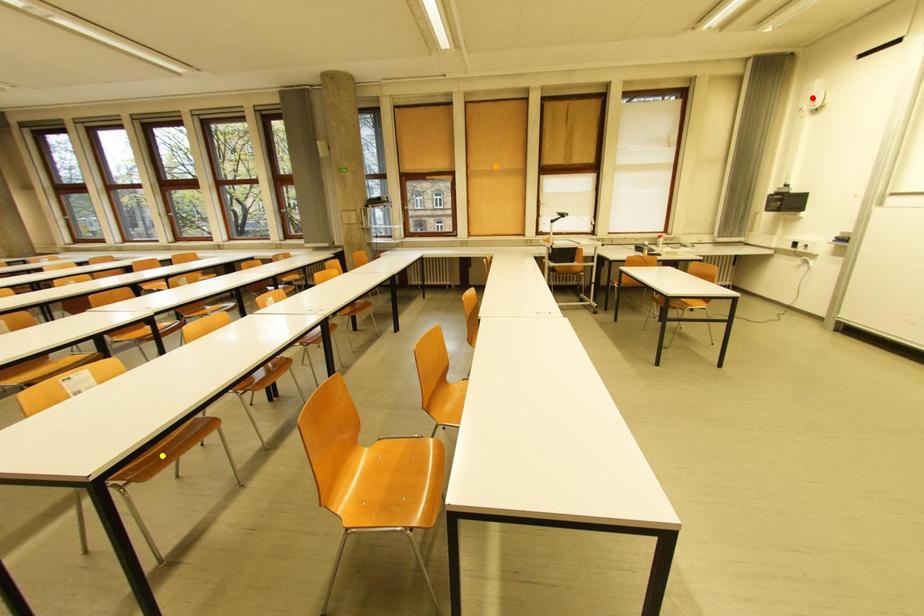
Order these from farthest to nearest:
1. red point
2. yellow point
3. orange point

orange point → red point → yellow point